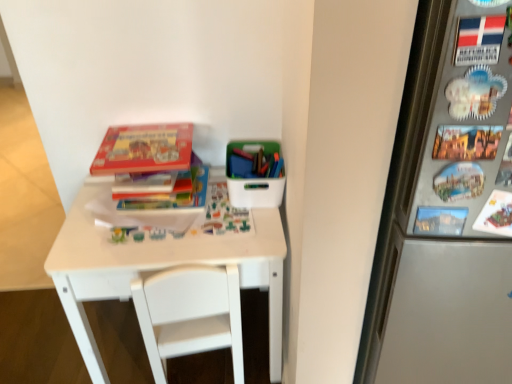
Where is `free space above matte cardboard book at upper left, acting as the second book starting from the bottom (from a real-world perspective)`? The image size is (512, 384). free space above matte cardboard book at upper left, acting as the second book starting from the bottom (from a real-world perspective) is located at coordinates (142, 148).